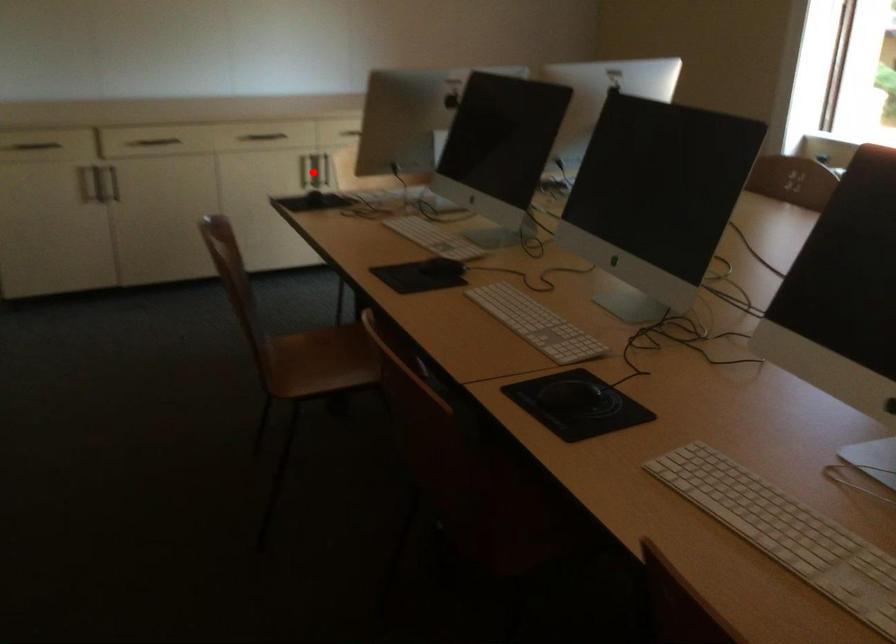
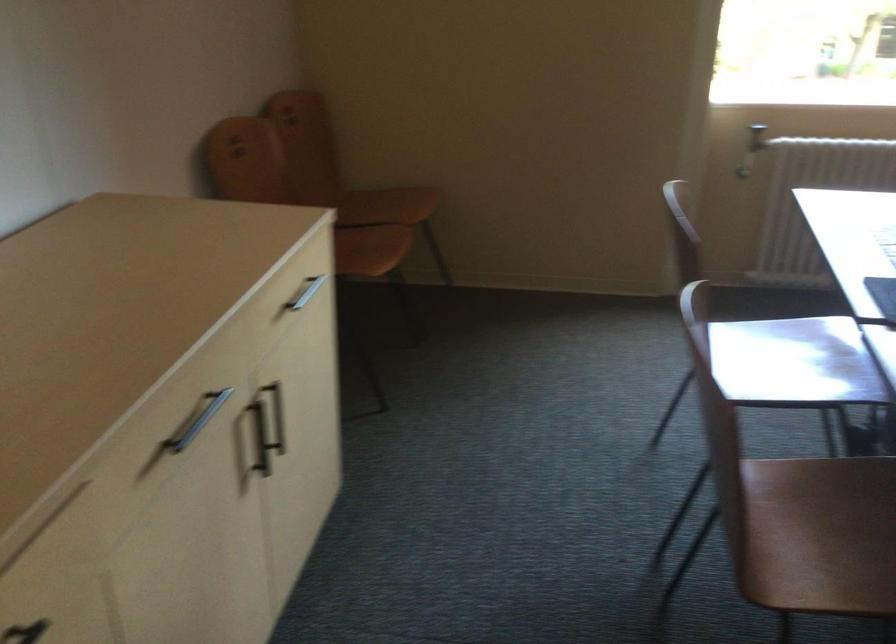
Locate, in the second image, the point that corresponds to the highlighted location in the first image.

(260, 438)